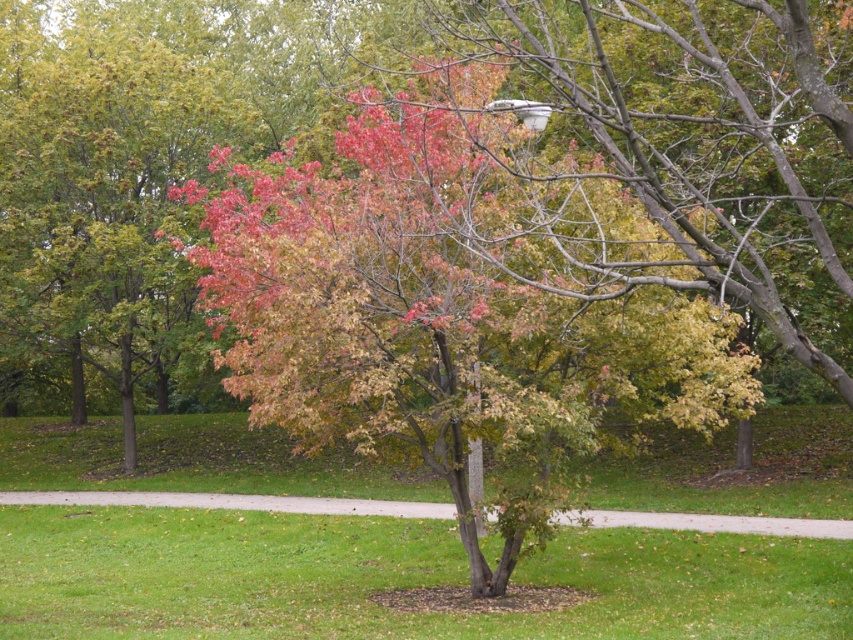
Based on the photo, you are a gardener planning to mow the green grass at center and concrete sidewalk at center. Which one should you mow first according to their positions?

The green grass at center is located below the concrete sidewalk at center, so you should mow the green grass at center first before the concrete sidewalk at center.

You are standing on the paved pathway in the park and want to walk towards the multicolored foliage at center and the green grass at center. Which one will you step onto first?

You will step onto the multicolored foliage at center first because it is closer to you than the green grass at center, which is further away.

You are a gardener planning to mow the green grass at center. Considering the multicolored foliage at center, will you need to adjust your path to avoid it? Please explain based on their widths.

The multicolored foliage at center has a lesser width compared to green grass at center. This means the foliage is narrower than the grass area, so you can easily mow the green grass at center without needing to adjust your path around the multicolored foliage at center.